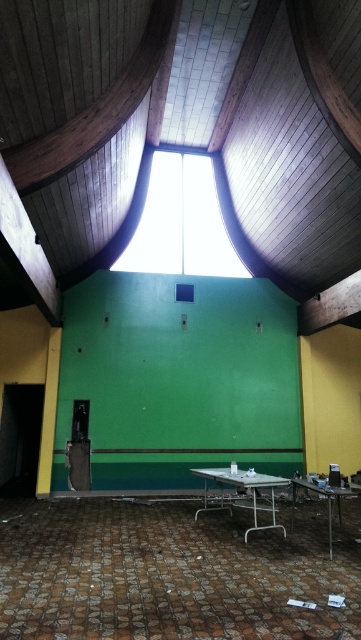
Question: Where is metallic silver table at center located in relation to metallic silver table at lower right in the image?

Choices:
 (A) left
 (B) right

Answer: (A)

Question: Which point is closer to the camera taking this photo?

Choices:
 (A) (331, 545)
 (B) (190, 180)
 (C) (222, 500)

Answer: (A)

Question: Is transparent glass window at center wider than metallic silver table at center?

Choices:
 (A) yes
 (B) no

Answer: (A)

Question: In this image, where is metallic silver table at center located relative to metallic silver table at lower right?

Choices:
 (A) above
 (B) below

Answer: (B)

Question: Which of the following is the closest to the observer?

Choices:
 (A) (203, 468)
 (B) (148, 260)

Answer: (A)

Question: Which object appears farthest from the camera in this image?

Choices:
 (A) transparent glass window at center
 (B) metallic silver table at lower right

Answer: (A)